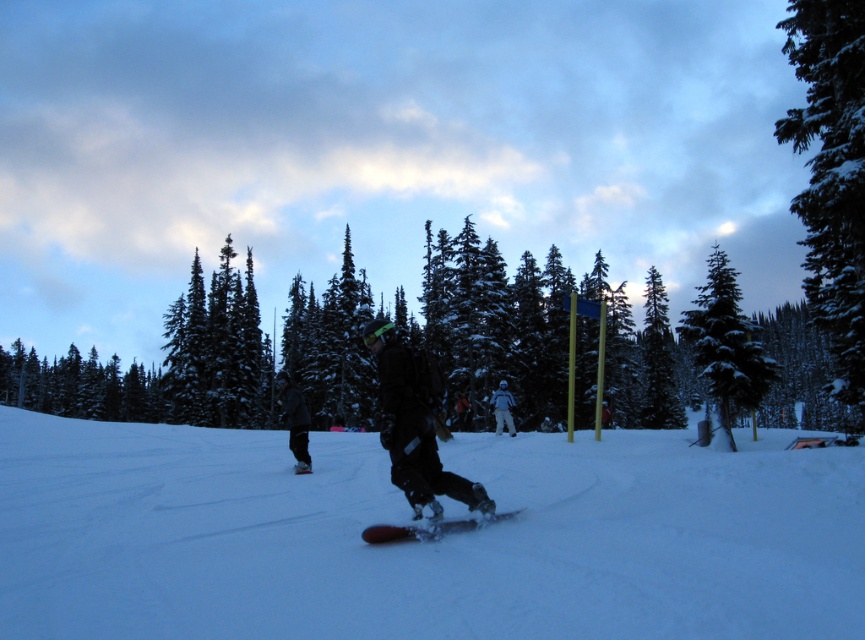
Question: Can you confirm if black matte snowboard at center is smaller than white matte snowboarder at center?

Choices:
 (A) no
 (B) yes

Answer: (B)

Question: Does green matte tree at upper left have a lesser width compared to red matte snowboard at center?

Choices:
 (A) yes
 (B) no

Answer: (B)

Question: Which object appears closest to the camera in this image?

Choices:
 (A) white matte snowboarder at center
 (B) green matte tree at upper left

Answer: (A)

Question: Does snow-covered evergreen at center-right appear over red matte snowboard at center?

Choices:
 (A) no
 (B) yes

Answer: (B)

Question: Which point is closer to the camera?

Choices:
 (A) (699, 362)
 (B) (465, 520)
 (C) (413, 388)

Answer: (C)

Question: Which object appears farthest from the camera in this image?

Choices:
 (A) snowy evergreen tree at right
 (B) green matte tree at upper left
 (C) snow-covered evergreen at center-right

Answer: (B)